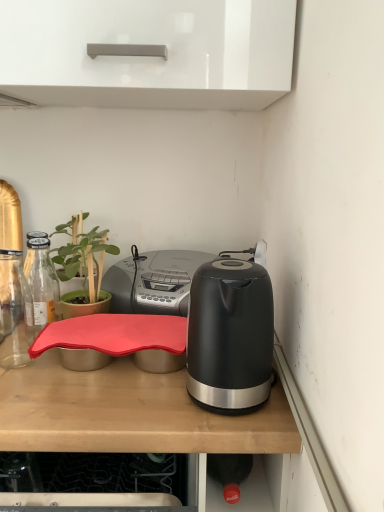
Question: Is black glossy kettle at right taller than rubberized red tray at center?

Choices:
 (A) no
 (B) yes

Answer: (A)

Question: Is black glossy kettle at right positioned far away from rubberized red tray at center?

Choices:
 (A) no
 (B) yes

Answer: (A)

Question: From a real-world perspective, is black glossy kettle at right located higher than rubberized red tray at center?

Choices:
 (A) yes
 (B) no

Answer: (A)

Question: Does black glossy kettle at right have a larger size compared to rubberized red tray at center?

Choices:
 (A) yes
 (B) no

Answer: (B)

Question: From the image's perspective, does black glossy kettle at right appear higher than rubberized red tray at center?

Choices:
 (A) no
 (B) yes

Answer: (B)

Question: From a real-world perspective, is black glossy kettle at right above or below green matte plant at left?

Choices:
 (A) below
 (B) above

Answer: (B)

Question: Considering the positions of black glossy kettle at right and green matte plant at left in the image, is black glossy kettle at right wider or thinner than green matte plant at left?

Choices:
 (A) thin
 (B) wide

Answer: (A)

Question: Is black glossy kettle at right in front of or behind green matte plant at left in the image?

Choices:
 (A) behind
 (B) front

Answer: (B)

Question: Do you think black glossy kettle at right is within green matte plant at left, or outside of it?

Choices:
 (A) outside
 (B) inside

Answer: (A)

Question: In terms of size, does rubberized red tray at center appear bigger or smaller than matte black kettle at right?

Choices:
 (A) big
 (B) small

Answer: (A)

Question: Is rubberized red tray at center inside or outside of matte black kettle at right?

Choices:
 (A) outside
 (B) inside

Answer: (A)

Question: Considering the positions of point (132, 382) and point (135, 288), is point (132, 382) closer or farther from the camera than point (135, 288)?

Choices:
 (A) farther
 (B) closer

Answer: (B)

Question: Considering the positions of rubberized red tray at center and matte black kettle at right in the image, is rubberized red tray at center taller or shorter than matte black kettle at right?

Choices:
 (A) tall
 (B) short

Answer: (A)

Question: Considering the positions of black glossy kettle at right and rubberized red tray at center in the image, is black glossy kettle at right wider or thinner than rubberized red tray at center?

Choices:
 (A) thin
 (B) wide

Answer: (A)

Question: Is black glossy kettle at right in front of or behind rubberized red tray at center in the image?

Choices:
 (A) front
 (B) behind

Answer: (B)